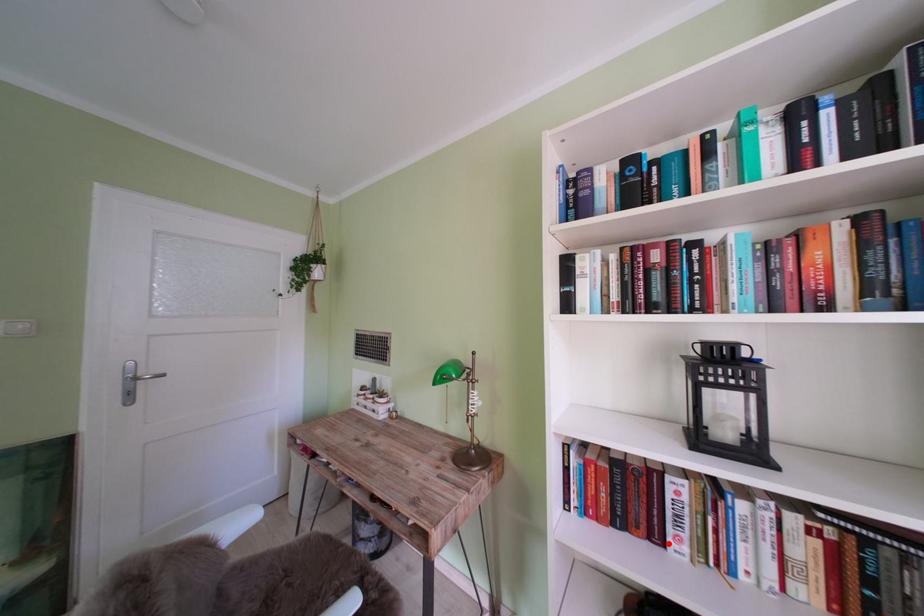
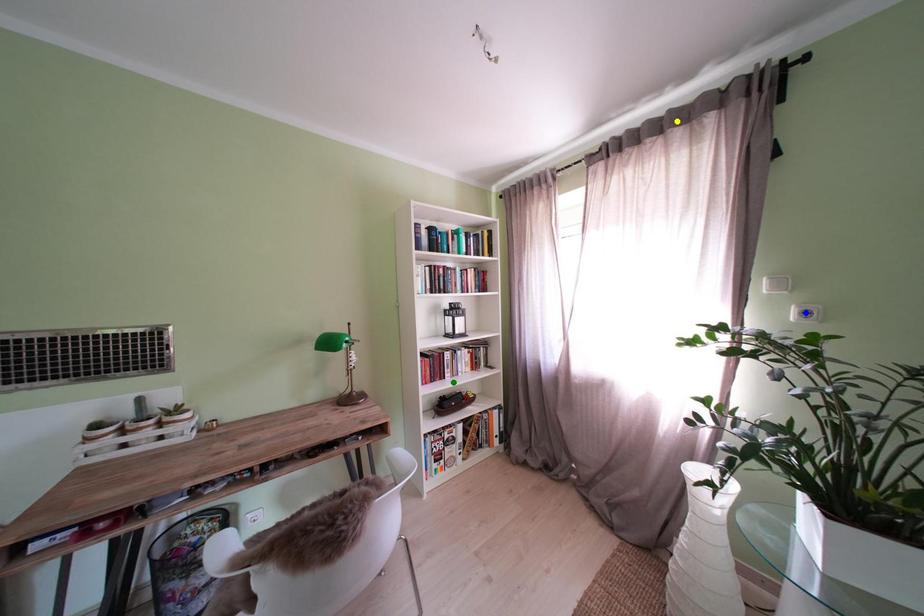
Question: I am providing you with two images of the same scene from different viewpoints. A red point is marked on the first image. You are given multiple points on the second image. Which point in image 2 represents the same 3d spot as the red point in image 1?

Choices:
 (A) blue point
 (B) green point
 (C) yellow point

Answer: (B)